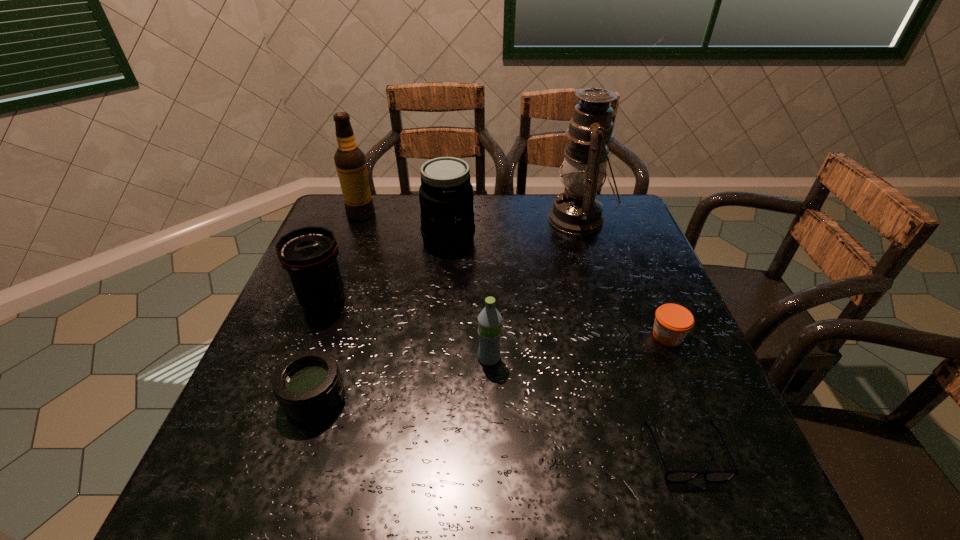
Image resolution: width=960 pixels, height=540 pixels. Identify the location of object located in the near right corner section of the desktop. (675, 476).

In the image, there is a desktop. Identify the location of free region at the near edge. (487, 462).

In the image, there is a desktop. Where is `free region at the left edge`? The height and width of the screenshot is (540, 960). free region at the left edge is located at coordinates (301, 307).

The width and height of the screenshot is (960, 540). I want to click on vacant region at the right edge of the desktop, so click(662, 402).

This screenshot has height=540, width=960. Identify the location of free space at the near left corner. (292, 473).

Find the location of a particular element. This screenshot has width=960, height=540. vacant space at the far right corner of the desktop is located at coordinates (613, 217).

This screenshot has width=960, height=540. In order to click on free space at the near right corner of the desktop in this screenshot , I will do `click(681, 499)`.

I want to click on vacant area between the water bottle and the jam, so click(578, 347).

Identify the location of free space between the seventh shortest object and the jam. This screenshot has width=960, height=540. (515, 275).

The width and height of the screenshot is (960, 540). Identify the location of free spot between the seventh tallest object and the shortest telephoto lens. pyautogui.click(x=492, y=367).